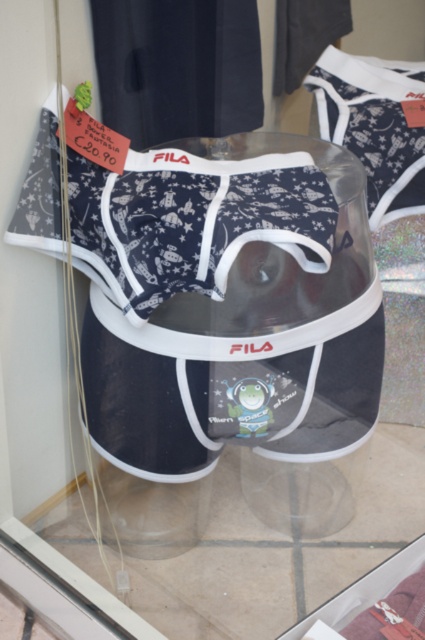
Question: Can you confirm if navy blue cotton boxer shorts at center is smaller than transparent plastic at center?

Choices:
 (A) yes
 (B) no

Answer: (A)

Question: Can you confirm if navy blue cotton boxer shorts at center is positioned above transparent plastic at center?

Choices:
 (A) no
 (B) yes

Answer: (B)

Question: Which point is farther from the camera taking this photo?

Choices:
 (A) (302, 547)
 (B) (119, 285)

Answer: (A)

Question: Does navy blue cotton boxer shorts at center appear on the right side of transparent plastic at center?

Choices:
 (A) no
 (B) yes

Answer: (A)